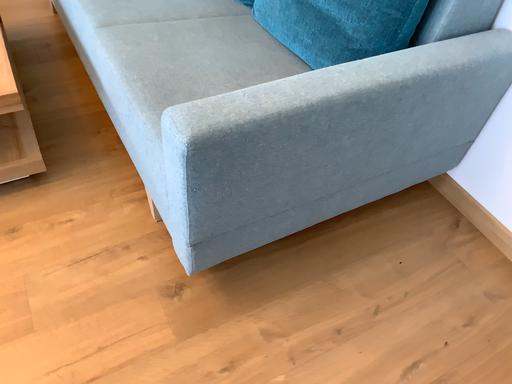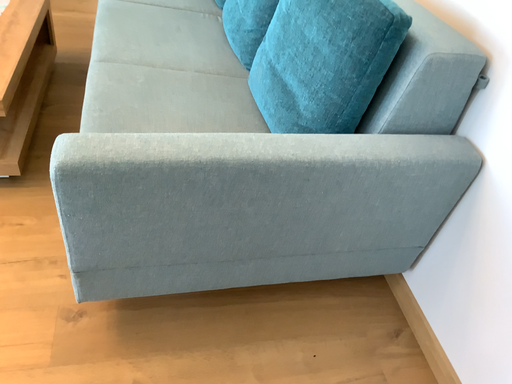
Question: Which way did the camera rotate in the video?

Choices:
 (A) rotated upward
 (B) rotated downward

Answer: (A)